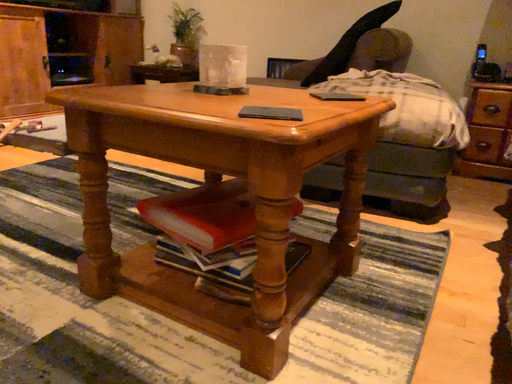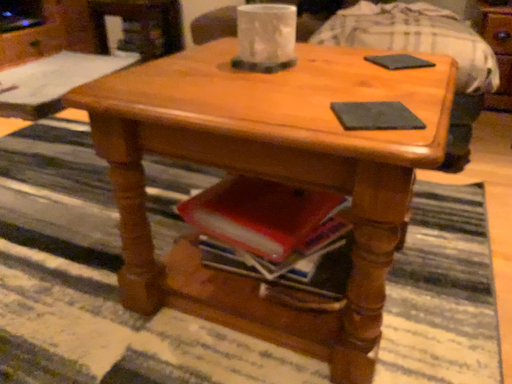
Question: Which way did the camera rotate in the video?

Choices:
 (A) rotated downward
 (B) rotated upward

Answer: (A)